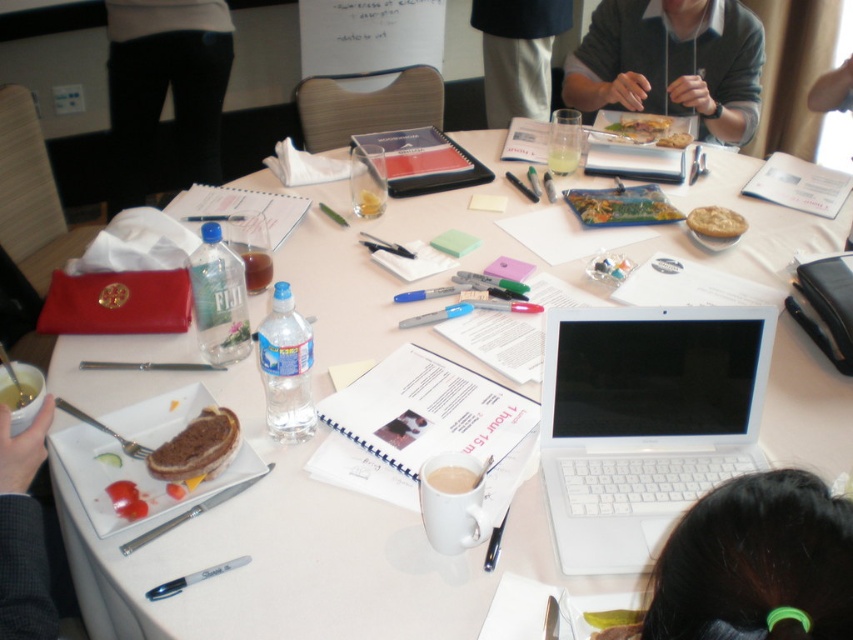
Who is positioned more to the left, golden crispy bread at upper center or golden flaky pie at center?

Positioned to the left is golden crispy bread at upper center.

Based on the photo, is golden crispy bread at upper center to the right of golden flaky pie at center from the viewer's perspective?

In fact, golden crispy bread at upper center is to the left of golden flaky pie at center.

Identify the location of golden crispy bread at upper center. The image size is (853, 640). (643, 129).

Which of these two, gray sweater at upper right or golden crispy bread at upper center, stands shorter?

Standing shorter between the two is golden crispy bread at upper center.

What do you see at coordinates (672, 64) in the screenshot? I see `gray sweater at upper right` at bounding box center [672, 64].

Does point (718, 118) come farther from viewer compared to point (619, 113)?

No, (718, 118) is in front of (619, 113).

Where is `gray sweater at upper right`? Image resolution: width=853 pixels, height=640 pixels. gray sweater at upper right is located at coordinates (672, 64).

Is white plastic laptop at center bigger than matte plastic bagel at center?

Yes.

From the picture: Can you confirm if white plastic laptop at center is thinner than matte plastic bagel at center?

Incorrect, white plastic laptop at center's width is not less than matte plastic bagel at center's.

Is point (695, 468) more distant than point (628, 211)?

No, (695, 468) is closer to viewer.

Identify the location of white plastic laptop at center. (643, 422).